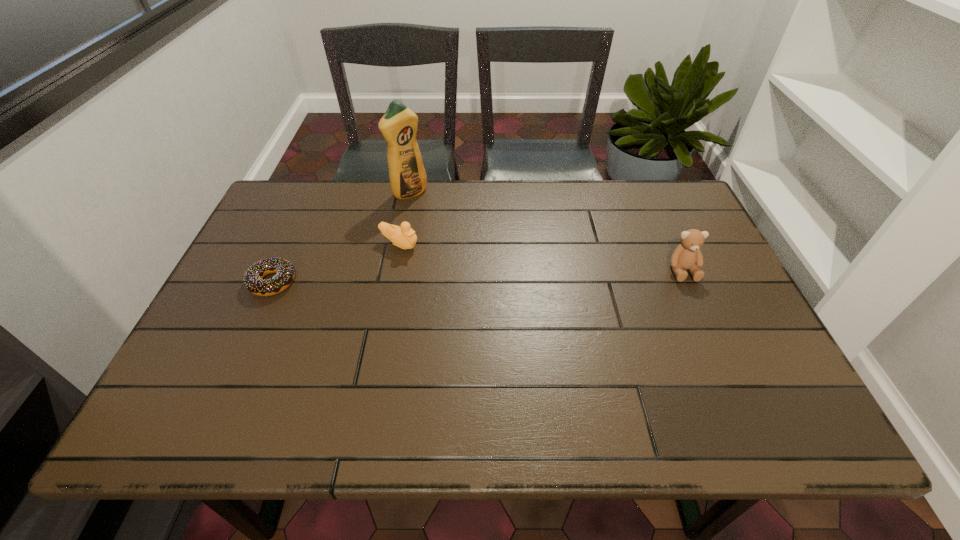
I want to click on the shortest object, so click(253, 279).

At what (x,y) coordinates should I click in order to perform the action: click on doughnut. Please return your answer as a coordinate pair (x, y). Looking at the image, I should click on (253, 279).

Find the location of a particular element. teddy bear is located at coordinates (687, 255).

This screenshot has height=540, width=960. I want to click on the second tallest object, so click(687, 255).

I want to click on the second shortest object, so click(403, 236).

You are a GUI agent. You are given a task and a screenshot of the screen. Output one action in this format:
    pyautogui.click(x=<x>, y=<y>)
    Task: Click on the duckling
    The width and height of the screenshot is (960, 540).
    Given the screenshot: What is the action you would take?
    pyautogui.click(x=403, y=236)

I want to click on detergent, so tap(399, 124).

The image size is (960, 540). Identify the location of the tallest object. (399, 124).

You are a GUI agent. You are given a task and a screenshot of the screen. Output one action in this format:
    pyautogui.click(x=<x>, y=<y>)
    Task: Click on the vacant space located 0.360m on the back of the leftmost object
    The image size is (960, 540).
    Given the screenshot: What is the action you would take?
    pyautogui.click(x=315, y=188)

The width and height of the screenshot is (960, 540). I want to click on free space located on the face of the rightmost object, so click(x=716, y=344).